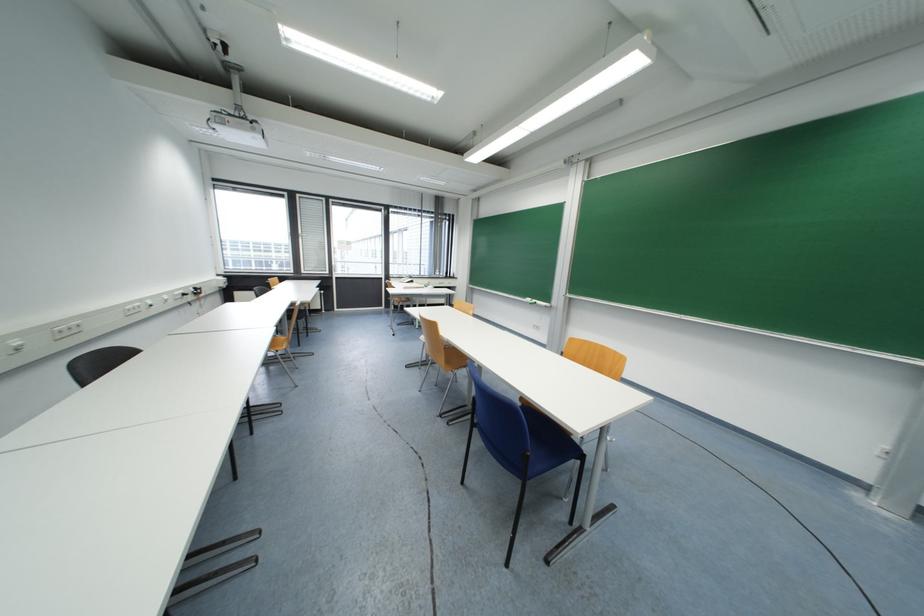
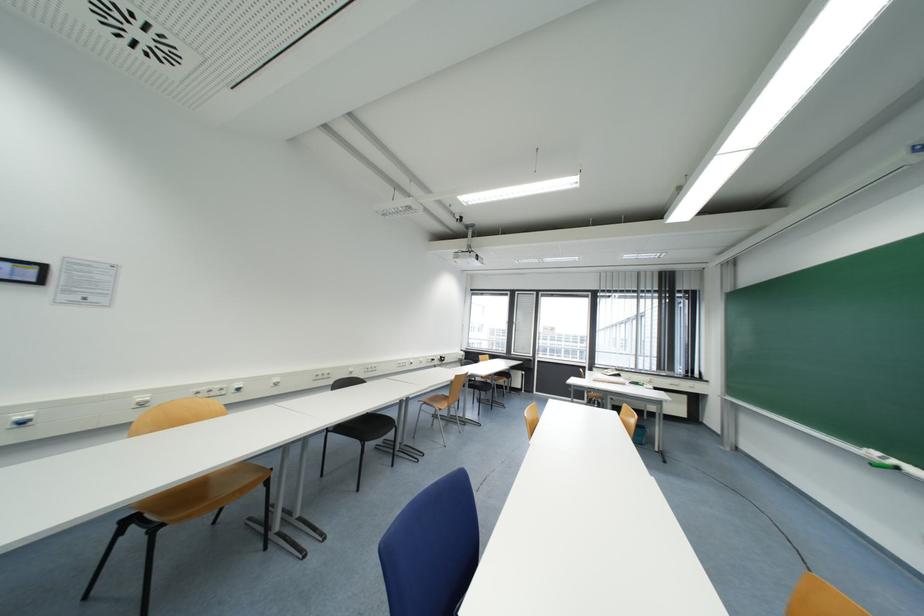
Where in the second image is the point corresponding to [566,163] from the first image?

(909, 154)